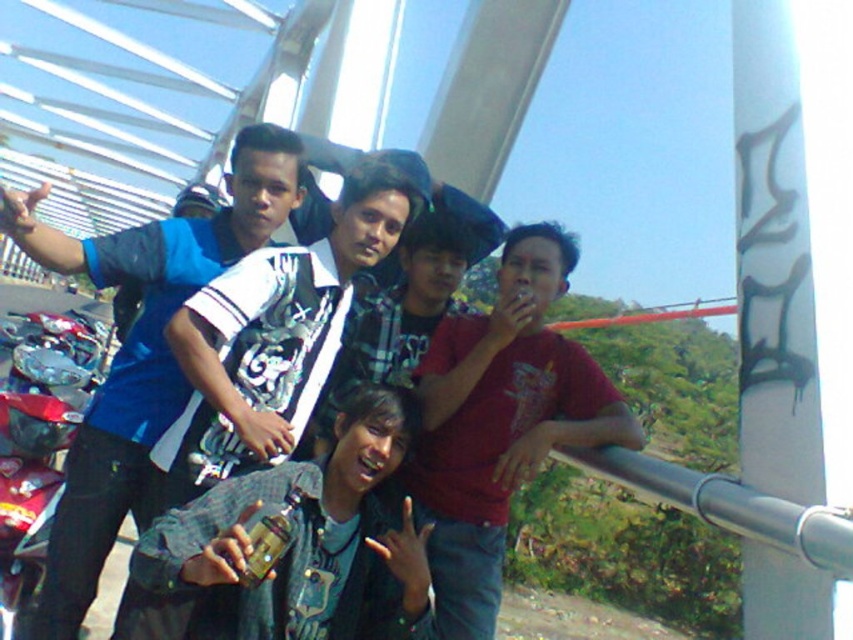
You are standing at the center of the bridge and want to find the matte red shirt at center. According to the coordinates provided, in which direction should you look relative to your position?

The matte red shirt at center is located at coordinates point (x=502, y=422), which means it is slightly to the right and above your current position at the center of the bridge.